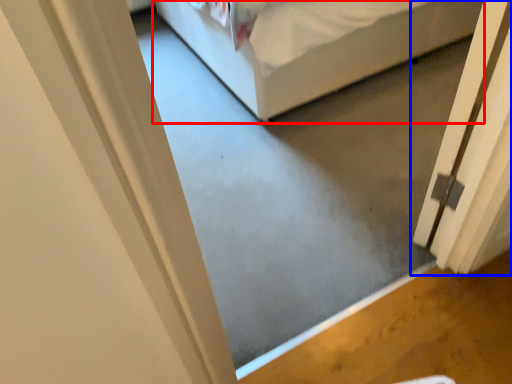
Question: Which of the following is the closest to the observer, bed (highlighted by a red box) or door (highlighted by a blue box)?

Choices:
 (A) bed
 (B) door

Answer: (B)